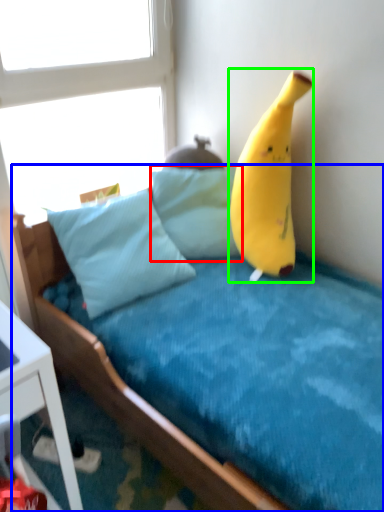
Question: Based on their relative distances, which object is nearer to pillow (highlighted by a red box)? Choose from bed (highlighted by a blue box) and banana (highlighted by a green box).

Choices:
 (A) bed
 (B) banana

Answer: (B)